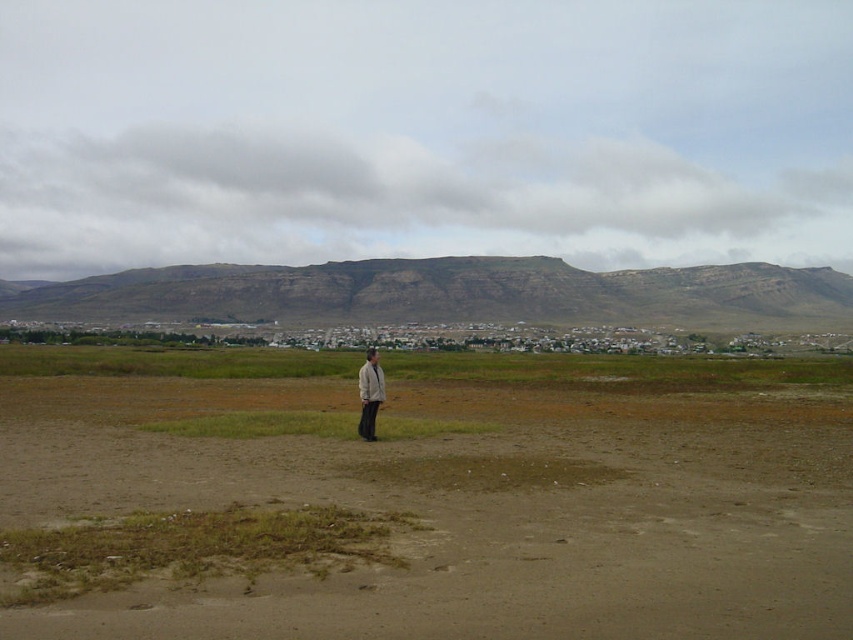
Is brown rocky mountain at upper center positioned at the back of light beige fabric jacket at center?

Yes, brown rocky mountain at upper center is further from the viewer.

Does brown rocky mountain at upper center have a lesser height compared to light beige fabric jacket at center?

No, brown rocky mountain at upper center is not shorter than light beige fabric jacket at center.

Is point (173, 296) positioned behind point (369, 406)?

Yes, point (173, 296) is behind point (369, 406).

The height and width of the screenshot is (640, 853). I want to click on brown rocky mountain at upper center, so [450, 292].

Based on the photo, can you confirm if brown sandy dirt field at center is positioned to the right of light beige fabric jacket at center?

Yes, brown sandy dirt field at center is to the right of light beige fabric jacket at center.

Does brown sandy dirt field at center have a larger size compared to light beige fabric jacket at center?

Yes.

The width and height of the screenshot is (853, 640). I want to click on brown sandy dirt field at center, so click(422, 497).

Who is more distant from viewer, [730,419] or [813,289]?

Positioned behind is point [813,289].

Where is `brown sandy dirt field at center`? This screenshot has height=640, width=853. brown sandy dirt field at center is located at coordinates (422, 497).